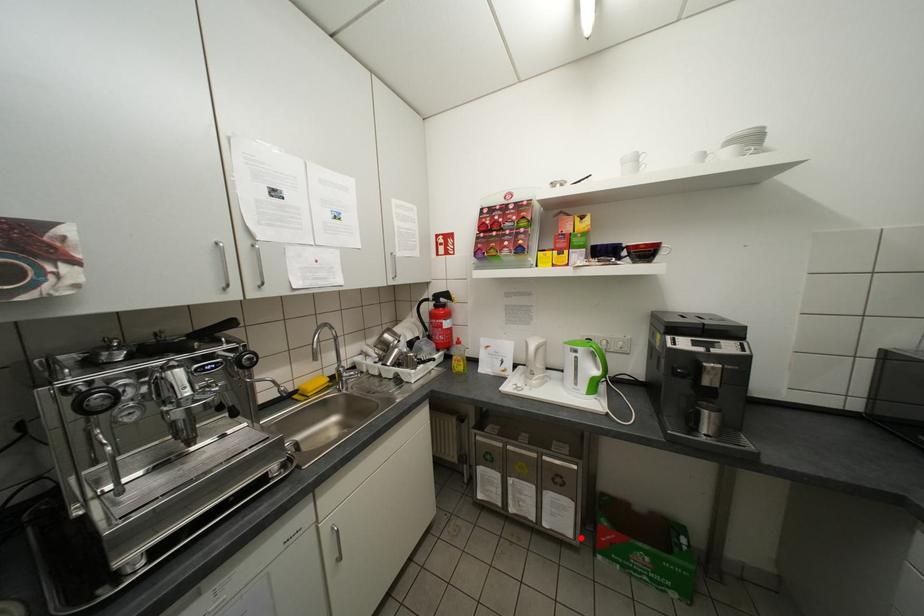
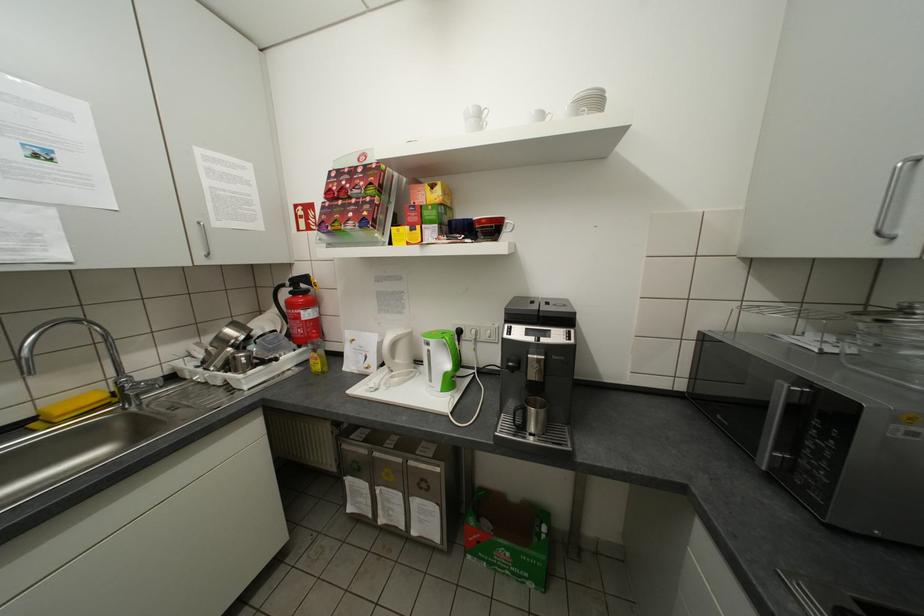
Question: A red point is marked in image1. In image2, is the corresponding 3D point closer to the camera or farther? Reply with the corresponding letter.

Choices:
 (A) The corresponding 3D point is closer.
 (B) The corresponding 3D point is farther.

Answer: (B)